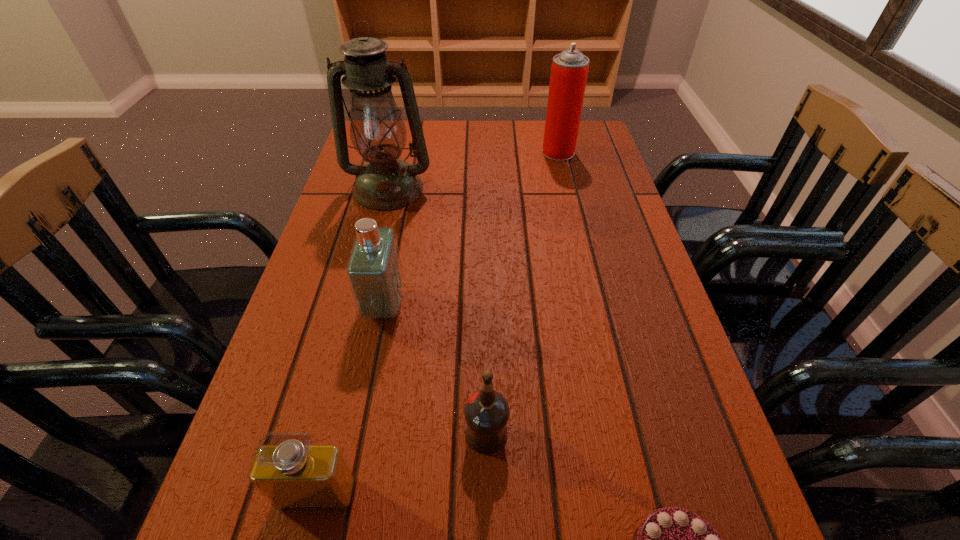
Find the location of a particular element. This screenshot has width=960, height=540. free space that satisfies the following two spatial constraints: 1. on the front label of the fourth object from left to right; 2. on the front-facing side of the shorter perfume is located at coordinates (487, 494).

Where is `vacant space that satisfies the following two spatial constraints: 1. on the front label of the taller perfume; 2. on the front-facing side of the nearer perfume`? This screenshot has width=960, height=540. vacant space that satisfies the following two spatial constraints: 1. on the front label of the taller perfume; 2. on the front-facing side of the nearer perfume is located at coordinates (348, 494).